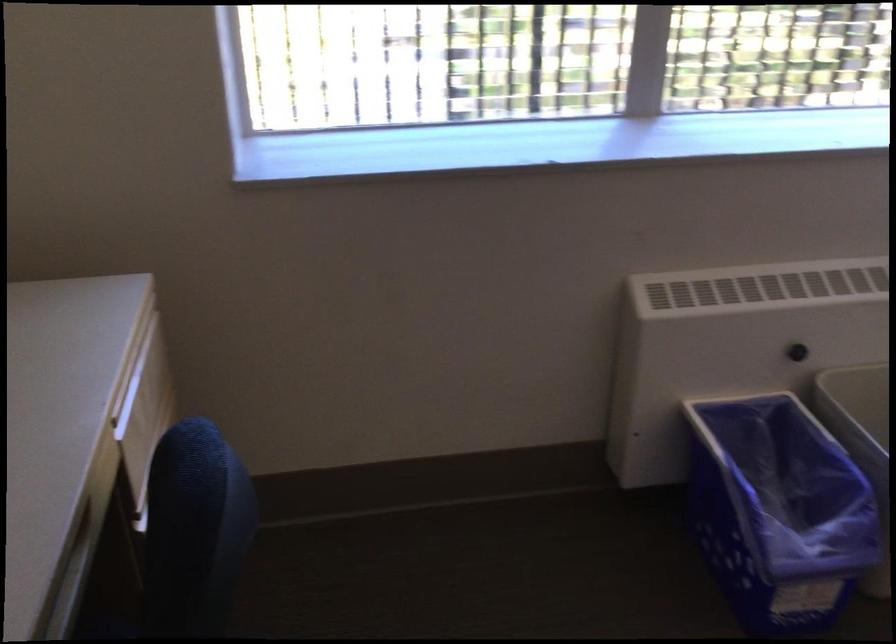
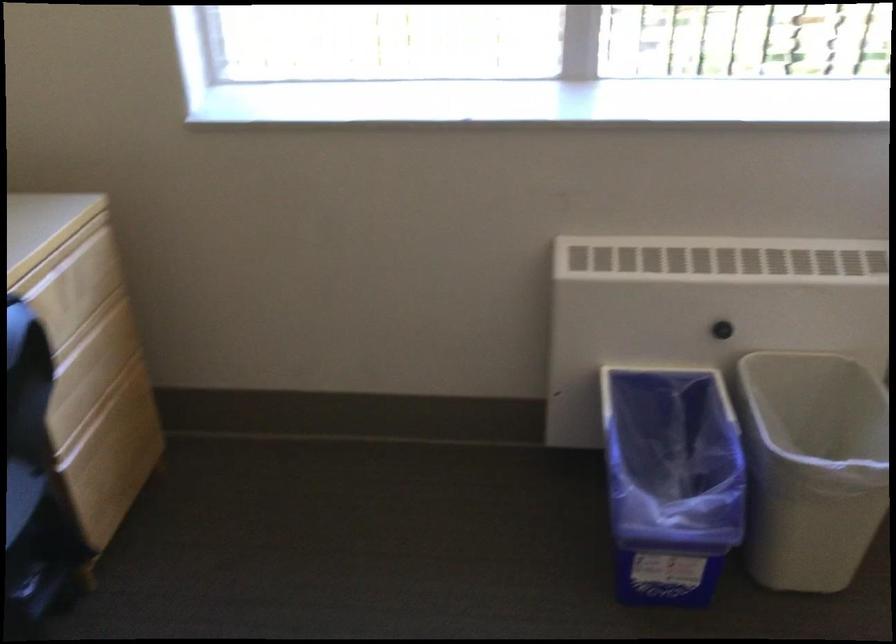
Question: The images are taken continuously from a first-person perspective. In which direction are you moving?

Choices:
 (A) Left
 (B) Right
 (C) Forward
 (D) Backward

Answer: (B)